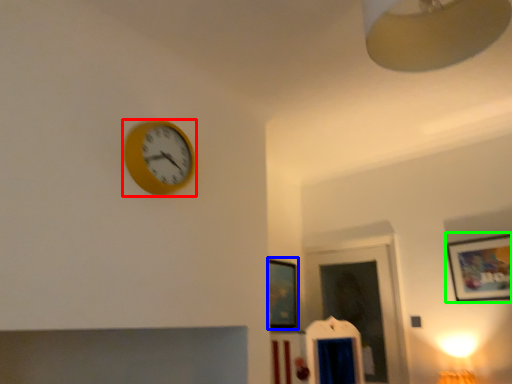
Question: Which object is the farthest from wall clock (highlighted by a red box)? Choose among these: picture frame (highlighted by a blue box) or picture frame (highlighted by a green box).

Choices:
 (A) picture frame
 (B) picture frame

Answer: (B)